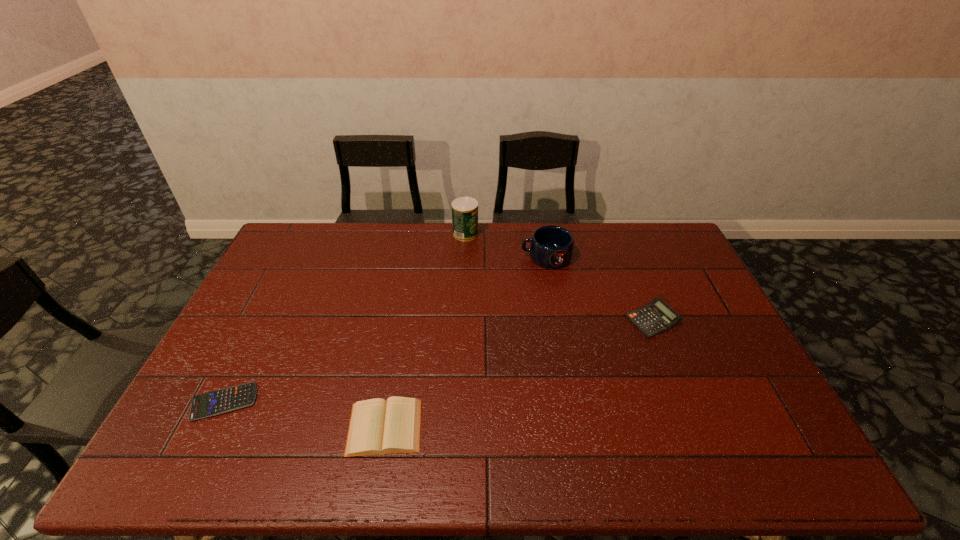
Find the location of a particular element. The image size is (960, 540). vacant area between the fourth object from right to left and the tallest object is located at coordinates (425, 330).

This screenshot has width=960, height=540. I want to click on free space between the diary and the third tallest object, so click(x=518, y=374).

Where is `free space between the second shortest object and the left calculator`? This screenshot has width=960, height=540. free space between the second shortest object and the left calculator is located at coordinates (304, 414).

This screenshot has width=960, height=540. Find the location of `free space between the shorter calculator and the second farthest object`. free space between the shorter calculator and the second farthest object is located at coordinates (385, 329).

Locate an element on the screen. The image size is (960, 540). free space between the fourth object from left to right and the leftmost object is located at coordinates (385, 329).

This screenshot has height=540, width=960. What are the coordinates of `vacant area that lies between the second object from left to right and the left calculator` in the screenshot? It's located at (304, 414).

Locate an element on the screen. This screenshot has width=960, height=540. vacant area that lies between the left calculator and the third farthest object is located at coordinates (438, 361).

Where is `vacant area that lies between the second shortest object and the third object from right to left`? vacant area that lies between the second shortest object and the third object from right to left is located at coordinates (425, 330).

Choose which object is the third nearest neighbor to the farthest object. Please provide its 2D coordinates. Your answer should be formatted as a tuple, i.e. [(x, y)], where the tuple contains the x and y coordinates of a point satisfying the conditions above.

[(377, 427)]

I want to click on object that is the second closest to the second tallest object, so [656, 317].